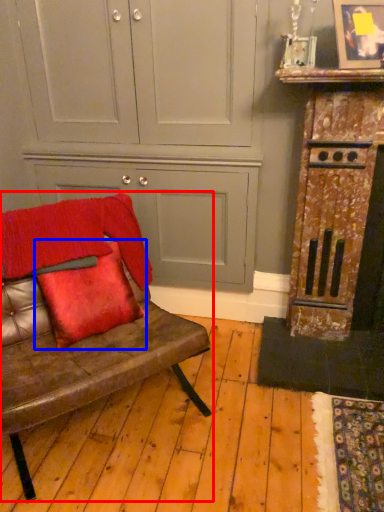
Question: Among these objects, which one is nearest to the camera, studio couch (highlighted by a red box) or pillow (highlighted by a blue box)?

Choices:
 (A) studio couch
 (B) pillow

Answer: (A)